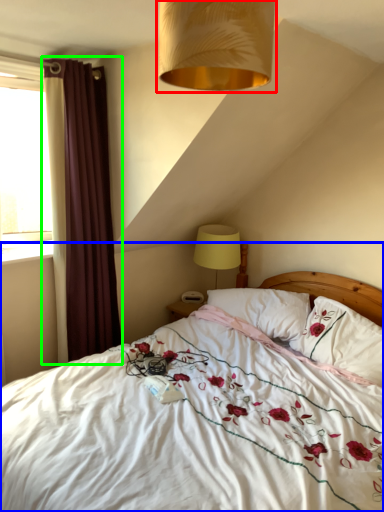
Question: Which is nearer to the lamp (highlighted by a red box)? bed (highlighted by a blue box) or curtain (highlighted by a green box).

Choices:
 (A) bed
 (B) curtain

Answer: (A)